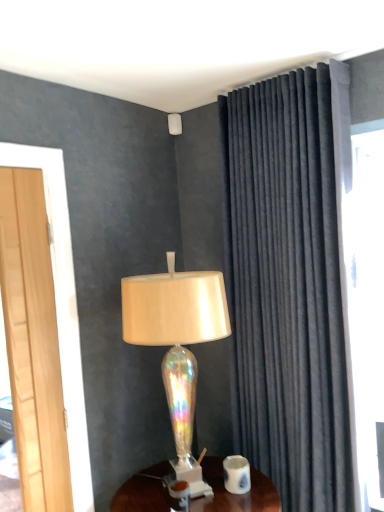
Question: From a real-world perspective, is velvet dark gray curtain at right on top of white glossy coffee cup at lower center?

Choices:
 (A) no
 (B) yes

Answer: (B)

Question: From the image's perspective, is velvet dark gray curtain at right on white glossy coffee cup at lower center?

Choices:
 (A) no
 (B) yes

Answer: (B)

Question: Does velvet dark gray curtain at right turn towards white glossy coffee cup at lower center?

Choices:
 (A) yes
 (B) no

Answer: (A)

Question: Considering the relative sizes of velvet dark gray curtain at right and white glossy coffee cup at lower center in the image provided, is velvet dark gray curtain at right smaller than white glossy coffee cup at lower center?

Choices:
 (A) no
 (B) yes

Answer: (A)

Question: Is velvet dark gray curtain at right surrounding white glossy coffee cup at lower center?

Choices:
 (A) no
 (B) yes

Answer: (A)

Question: Is white glossy coffee cup at lower center wider or thinner than velvet dark gray curtain at right?

Choices:
 (A) thin
 (B) wide

Answer: (A)

Question: From a real-world perspective, is white glossy coffee cup at lower center above or below velvet dark gray curtain at right?

Choices:
 (A) below
 (B) above

Answer: (A)

Question: Choose the correct answer: Is white glossy coffee cup at lower center inside velvet dark gray curtain at right or outside it?

Choices:
 (A) inside
 (B) outside

Answer: (B)

Question: Considering the positions of white glossy coffee cup at lower center and velvet dark gray curtain at right in the image, is white glossy coffee cup at lower center taller or shorter than velvet dark gray curtain at right?

Choices:
 (A) tall
 (B) short

Answer: (B)

Question: Would you say wooden desk at center is to the left or to the right of iridescent glass lamp at center, the 1th lamp when ordered from front to back, in the picture?

Choices:
 (A) right
 (B) left

Answer: (A)

Question: Is wooden desk at center spatially inside iridescent glass lamp at center, placed as the 2th lamp when sorted from left to right, or outside of it?

Choices:
 (A) outside
 (B) inside

Answer: (A)

Question: Relative to iridescent glass lamp at center, placed as the 2th lamp when sorted from top to bottom, is wooden desk at center in front or behind?

Choices:
 (A) front
 (B) behind

Answer: (A)

Question: From a real-world perspective, is wooden desk at center physically located above or below iridescent glass lamp at center, the 1th lamp when ordered from front to back?

Choices:
 (A) above
 (B) below

Answer: (B)

Question: Is wooden desk at center in front of or behind velvet dark gray curtain at right in the image?

Choices:
 (A) behind
 (B) front

Answer: (B)

Question: Does point (158, 506) appear closer or farther from the camera than point (301, 309)?

Choices:
 (A) closer
 (B) farther

Answer: (A)